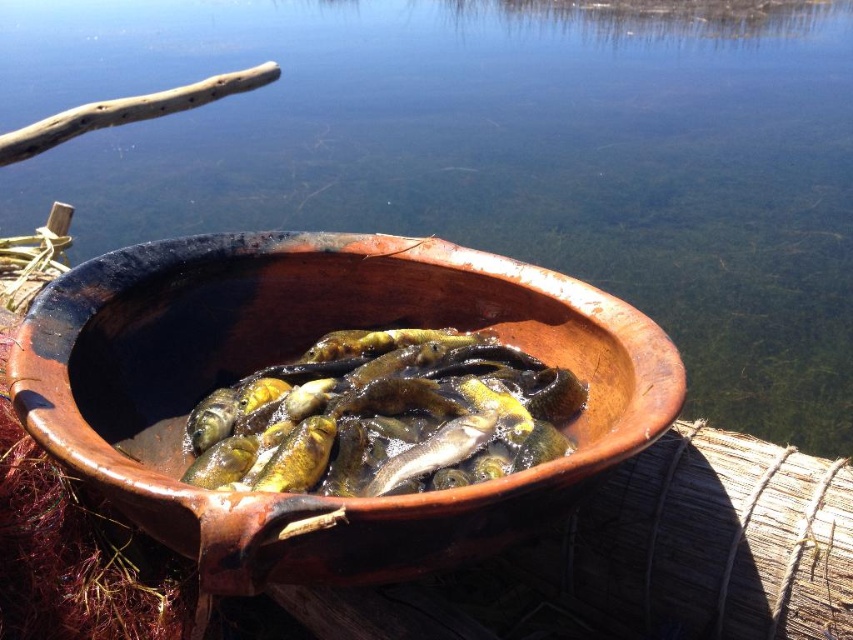
You are standing in front of the lake and see the point at coordinates (434, 451). What object is located at that point?

The point at coordinates (434, 451) corresponds to the shiny silver fish at center.